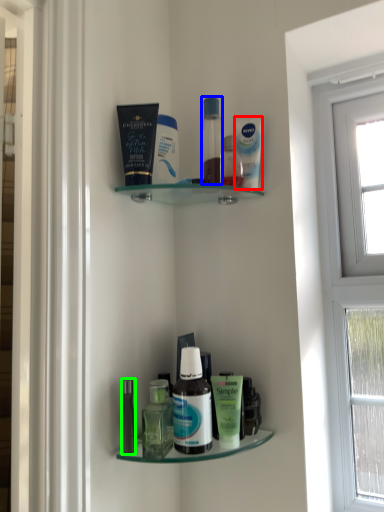
Question: Estimate the real-world distances between objects in this image. Which object is farther from mouthwash (highlighted by a red box), toiletry (highlighted by a blue box) or toiletry (highlighted by a green box)?

Choices:
 (A) toiletry
 (B) toiletry

Answer: (B)